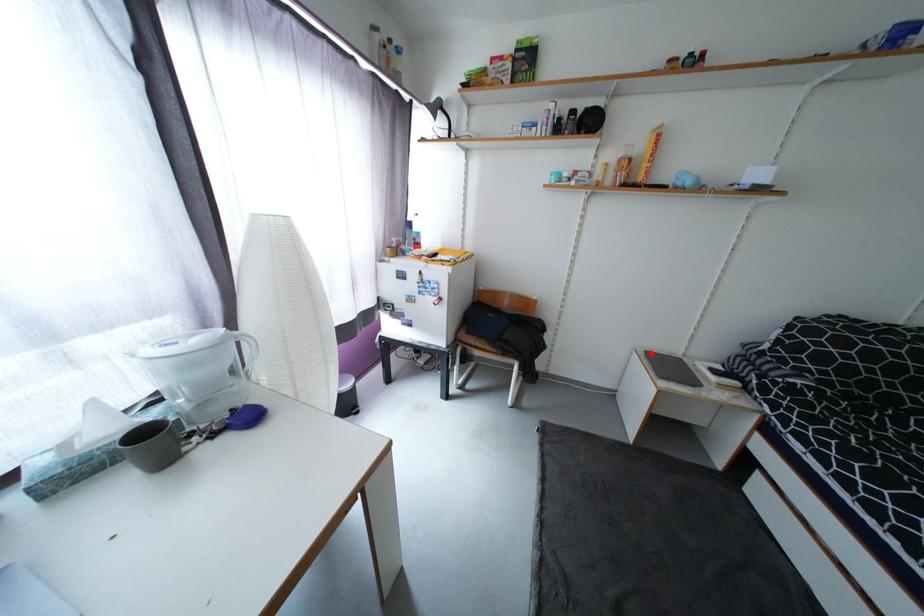
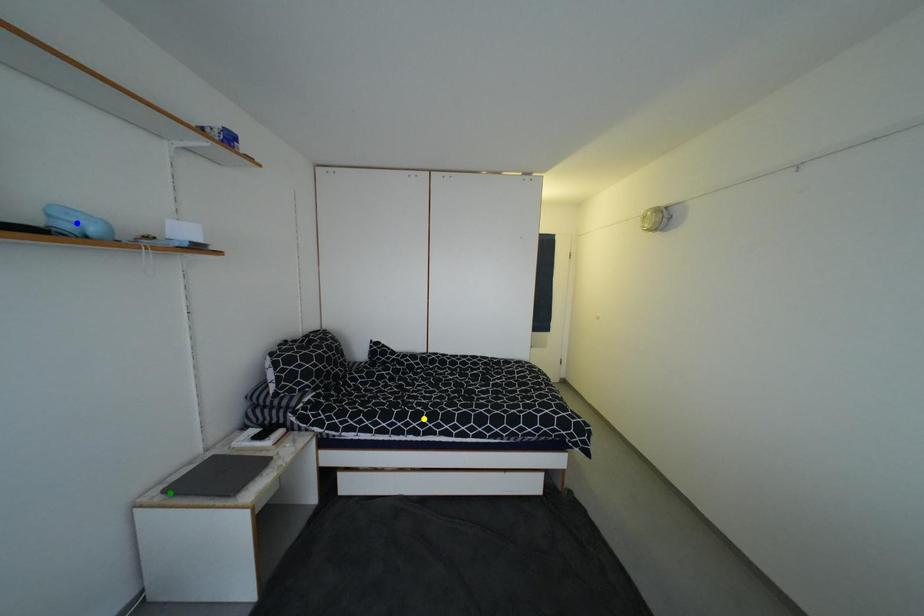
Question: I am providing you with two images of the same scene from different viewpoints. A red point is marked on the first image. You are given multiple points on the second image. In image 2, which mark is for the same physical point as the one in image 1?

Choices:
 (A) green point
 (B) yellow point
 (C) blue point

Answer: (A)